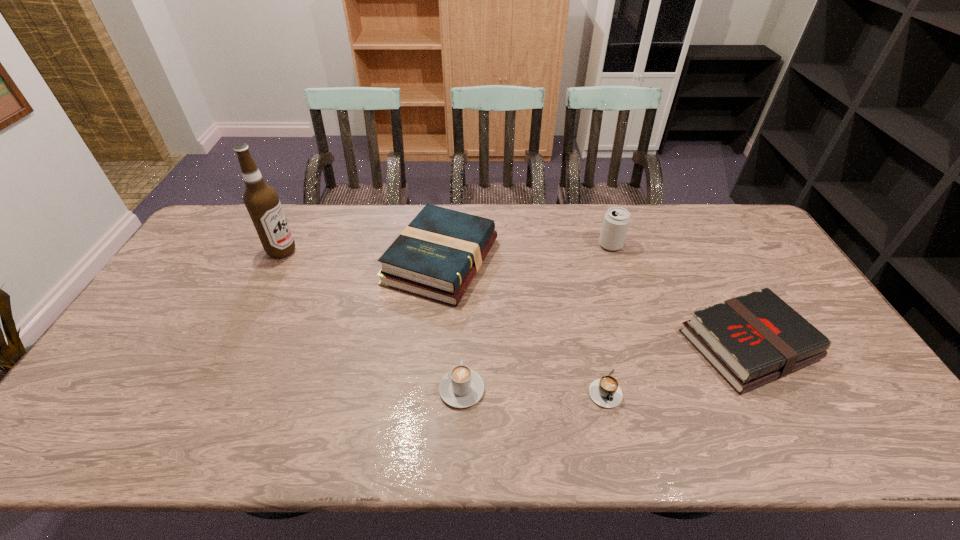
The width and height of the screenshot is (960, 540). Find the location of `empty space between the tallest object and the fourth shortest object`. empty space between the tallest object and the fourth shortest object is located at coordinates (362, 256).

At what (x,y) coordinates should I click in order to perform the action: click on vacant region between the second tallest object and the rightmost object. Please return your answer as a coordinate pair (x, y). The width and height of the screenshot is (960, 540). Looking at the image, I should click on (680, 295).

Find the location of `free space between the shorter hardback book and the fourth object from left to right`. free space between the shorter hardback book and the fourth object from left to right is located at coordinates [x=676, y=367].

This screenshot has width=960, height=540. In order to click on free point between the fourth object from left to right and the right hardback book in this screenshot , I will do `click(676, 367)`.

The width and height of the screenshot is (960, 540). In order to click on vacant area that lies between the second object from right to left and the taller cappuccino in this screenshot , I will do `click(536, 317)`.

This screenshot has width=960, height=540. I want to click on empty space between the right cappuccino and the taller cappuccino, so [533, 389].

Where is `vacant area that lies between the shorter hardback book and the fifth object from left to right`? vacant area that lies between the shorter hardback book and the fifth object from left to right is located at coordinates (680, 295).

Image resolution: width=960 pixels, height=540 pixels. What are the coordinates of `object that is the fifth closest to the tallest object` in the screenshot? It's located at (750, 340).

Identify which object is the closest to the tallest object. Please provide its 2D coordinates. Your answer should be formatted as a tuple, i.e. [(x, y)], where the tuple contains the x and y coordinates of a point satisfying the conditions above.

[(436, 256)]

Identify the location of vacant space that satisfies the following two spatial constraints: 1. on the front side of the second tallest object; 2. on the label of the alcohol. Image resolution: width=960 pixels, height=540 pixels. (612, 251).